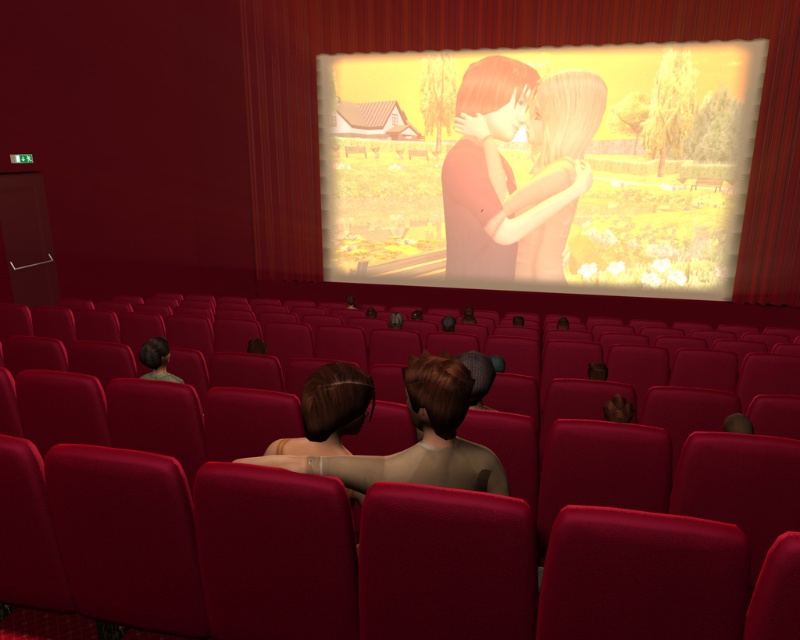
You are a moviegoer sitting in the front row of the theater. You want to take a photo of the smooth skin couple at center and the brown matte hair at center on the screen. Can you fit both subjects in your camera frame at the same time?

The smooth skin couple at center is 7.27 meters away from brown matte hair at center. Since they are positioned close to each other on the screen, you can likely fit both subjects in your camera frame simultaneously.

You are designing a poster for the movie shown on the theater screen. The poster must include both the smooth skin couple at center and the brown matte hair at center. If you want to maintain their relative sizes as seen on the screen, which object should you make larger?

The smooth skin couple at center should be made larger because its width is larger than the brown matte hair at center as seen on the screen.

You are a moviegoer sitting in the theater and looking at the screen. You notice two elements in the scene displayed on the screen. One is the smooth skin couple at center and the other is the brown matte hair at center. Which of these two elements is positioned higher on the screen?

The smooth skin couple at center is positioned higher on the screen because it is above the brown matte hair at center.